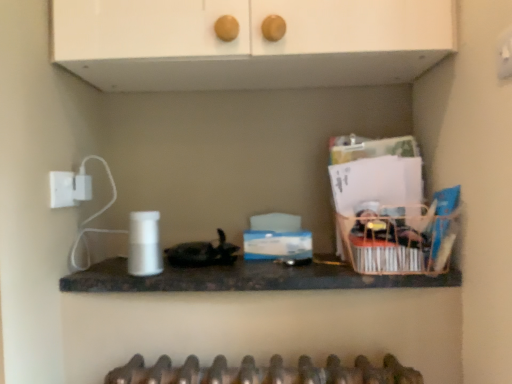
Question: Is white matte cabinet at upper center taller or shorter than wooden basket at right?

Choices:
 (A) tall
 (B) short

Answer: (A)

Question: From the image's perspective, is white matte cabinet at upper center above or below wooden basket at right?

Choices:
 (A) below
 (B) above

Answer: (B)

Question: Which of these objects is positioned farthest from the black marble countertop at center?

Choices:
 (A) wooden basket at right
 (B) white matte cabinet at upper center

Answer: (B)

Question: Which object is the farthest from the wooden basket at right?

Choices:
 (A) black marble countertop at center
 (B) white matte cabinet at upper center

Answer: (B)